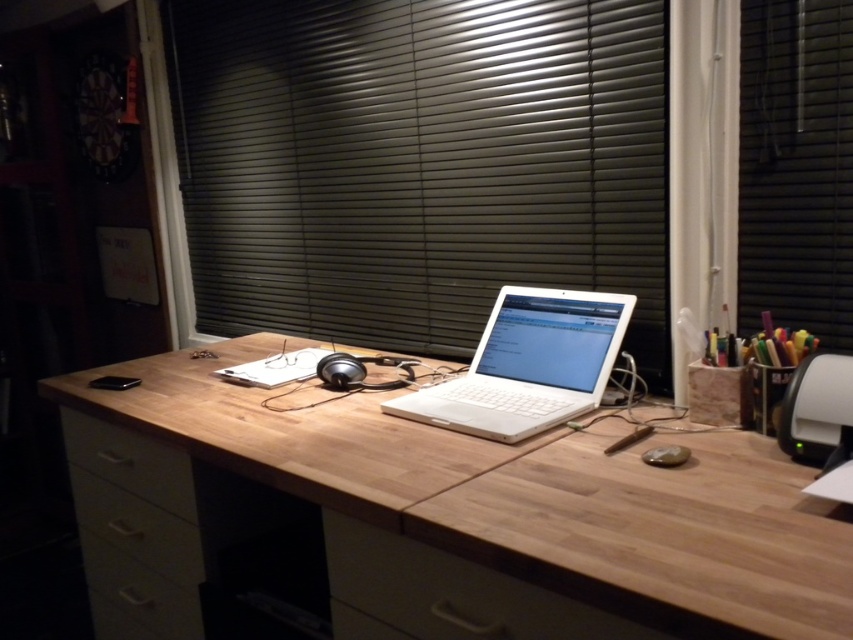
Is dark matte blinds at center to the left of matte black mouse at center from the viewer's perspective?

Yes, dark matte blinds at center is to the left of matte black mouse at center.

Measure the distance between dark matte blinds at center and camera.

The distance of dark matte blinds at center from camera is 1.34 meters.

At what (x,y) coordinates should I click in order to perform the action: click on dark matte blinds at center. Please return your answer as a coordinate pair (x, y). Image resolution: width=853 pixels, height=640 pixels. Looking at the image, I should click on (421, 163).

From the picture: Measure the distance from dark matte blinds at center to white matte drawer at lower left.

They are 38.67 inches apart.

Does dark matte blinds at center appear under white matte drawer at lower left?

Actually, dark matte blinds at center is above white matte drawer at lower left.

Which is behind, point (274, 166) or point (164, 513)?

Point (274, 166)

Where is `dark matte blinds at center`? dark matte blinds at center is located at coordinates (421, 163).

This screenshot has width=853, height=640. What do you see at coordinates (421, 163) in the screenshot? I see `dark matte blinds at center` at bounding box center [421, 163].

Which is in front, point (256, 268) or point (409, 369)?

Point (409, 369) is in front.

Locate an element on the screen. The image size is (853, 640). dark matte blinds at center is located at coordinates (421, 163).